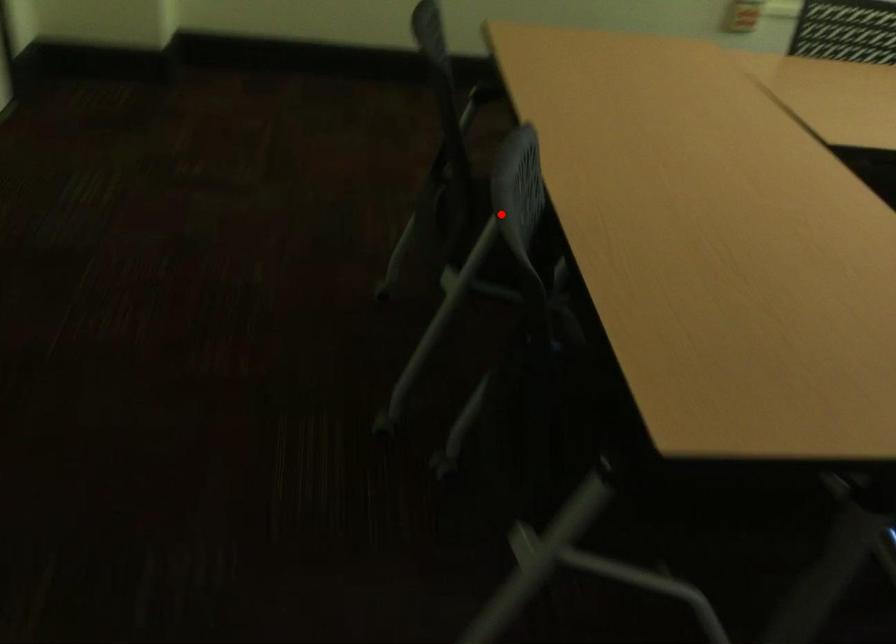
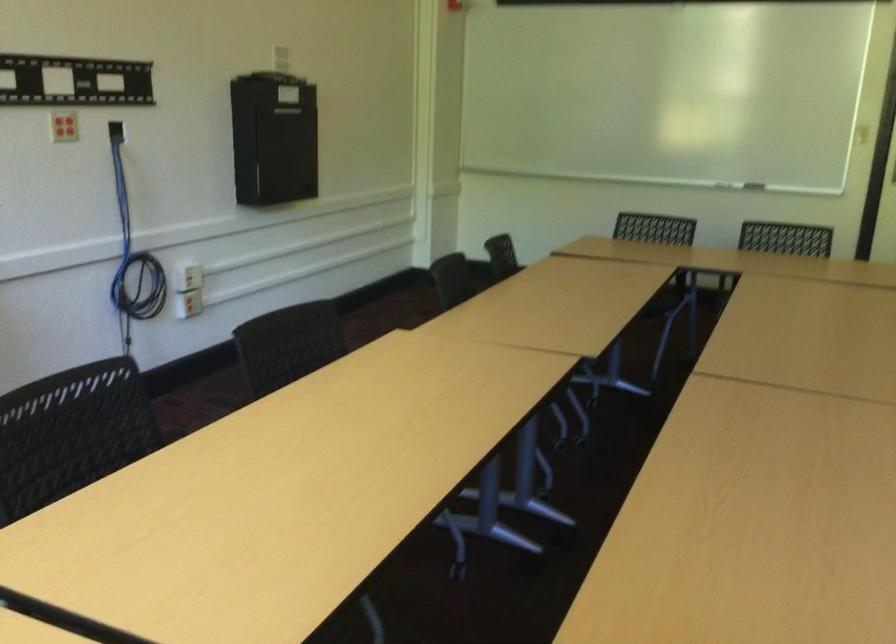
Question: I am providing you with two images of the same scene from different viewpoints. A red point is marked on the first image. At the location where the point appears in image 1, is it still visible in image 2?

Choices:
 (A) Yes
 (B) No

Answer: (B)